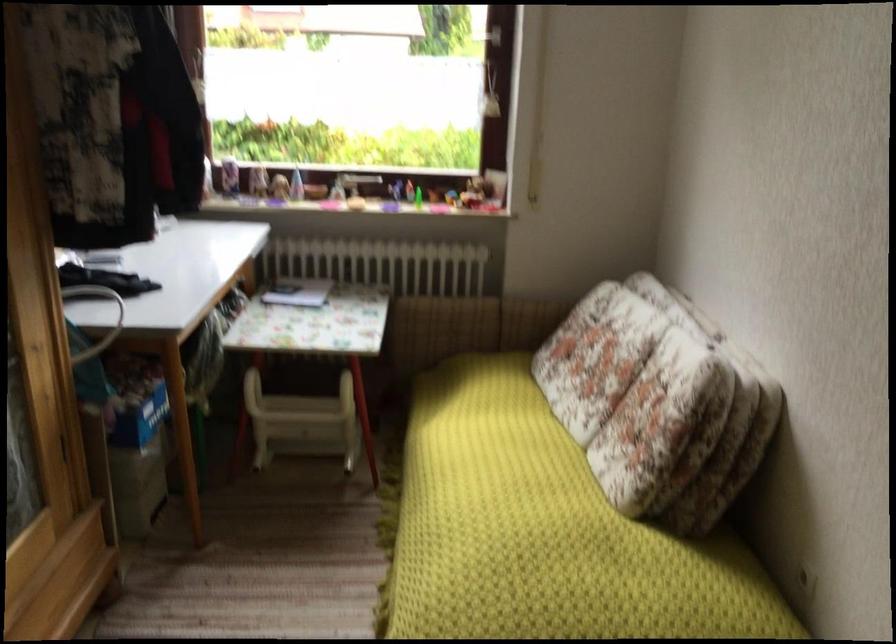
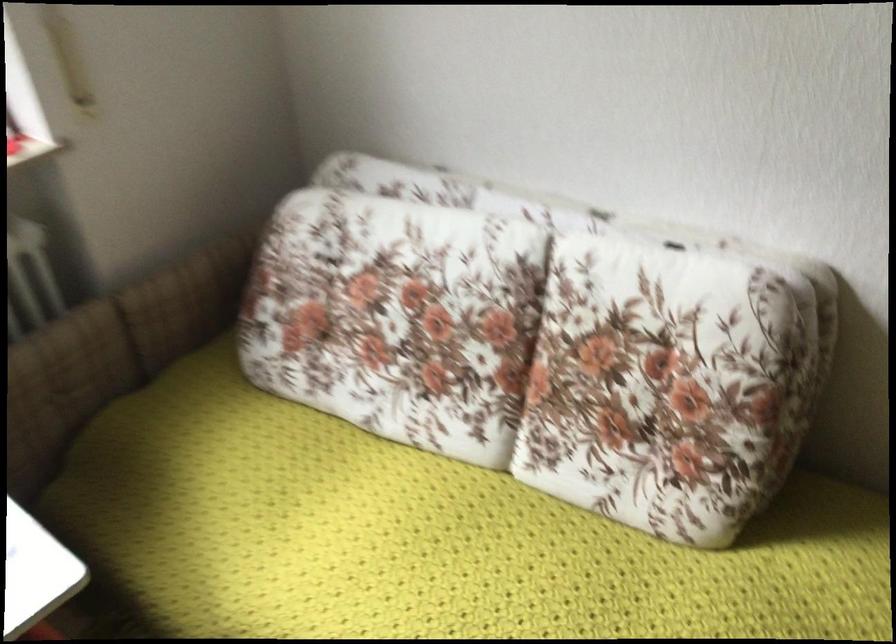
In the second image, find the point that corresponds to [630,386] in the first image.

(530, 354)